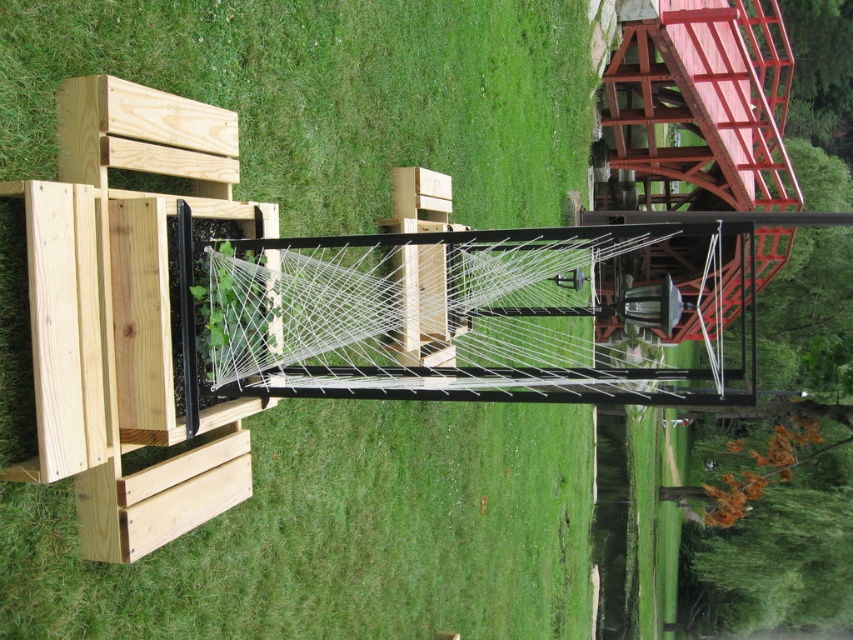
Question: Which of the following is the farthest from the observer?

Choices:
 (A) black metal rail at center
 (B) green grass at center

Answer: (A)

Question: Which point is farther from the camera taking this photo?

Choices:
 (A) (310, 36)
 (B) (363, 365)

Answer: (A)

Question: Is green grass at center wider than black metal rail at center?

Choices:
 (A) no
 (B) yes

Answer: (A)

Question: Is green grass at center closer to camera compared to black metal rail at center?

Choices:
 (A) yes
 (B) no

Answer: (A)

Question: Does green grass at center lie in front of black metal rail at center?

Choices:
 (A) yes
 (B) no

Answer: (A)

Question: Which point appears closest to the camera in this image?

Choices:
 (A) (575, 392)
 (B) (361, 90)

Answer: (A)